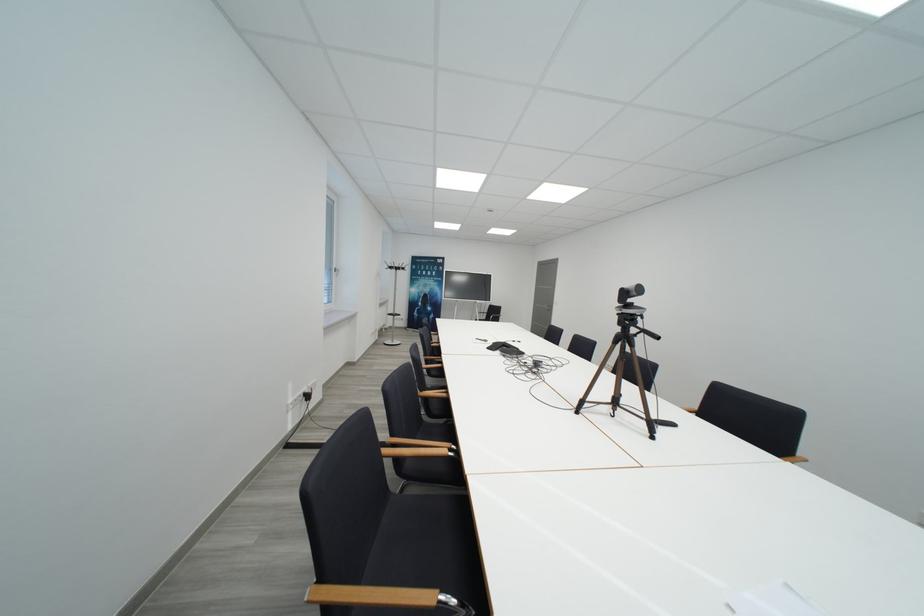
Where would you us the conference phone? Please return your answer as a coordinate pair (x, y).

(505, 350)